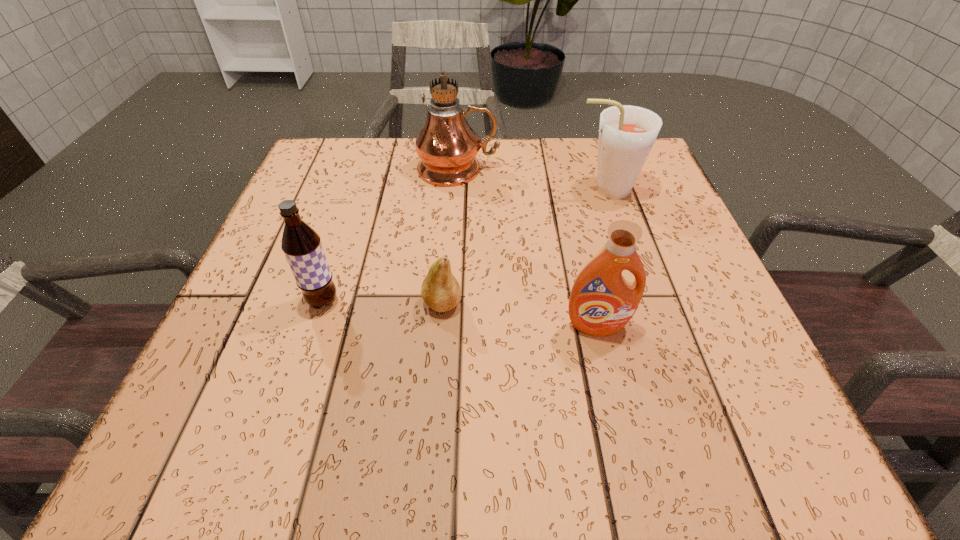
In order to click on empty space that is in between the right root beer and the pear in this screenshot , I will do `click(523, 247)`.

Where is `free space between the oil lamp and the leftmost object`? The image size is (960, 540). free space between the oil lamp and the leftmost object is located at coordinates (391, 235).

Locate an element on the screen. vacant space that is in between the detergent and the shortest object is located at coordinates (519, 315).

Locate an element on the screen. vacant space that's between the oil lamp and the farther root beer is located at coordinates (532, 179).

At what (x,y) coordinates should I click in order to perform the action: click on blank region between the detergent and the tallest object. Please return your answer as a coordinate pair (x, y). Looking at the image, I should click on (528, 247).

Find the location of `object that is the third closest to the right root beer`. object that is the third closest to the right root beer is located at coordinates (440, 290).

Where is `the second closest object to the tallest object`? This screenshot has height=540, width=960. the second closest object to the tallest object is located at coordinates (440, 290).

In order to click on free spot that satisfies the following two spatial constraints: 1. on the drink side of the farther root beer; 2. on the front side of the leftmost object in this screenshot , I will do `click(642, 301)`.